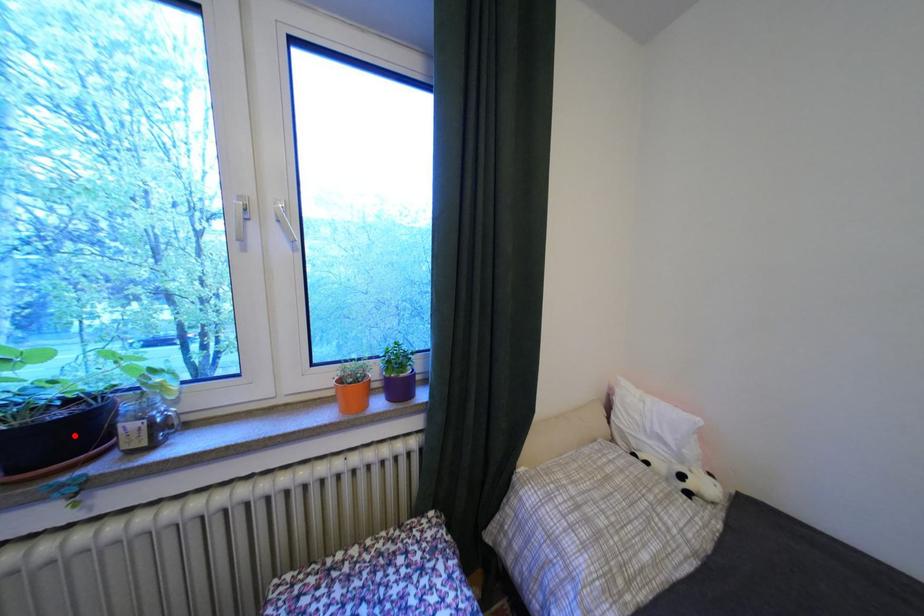
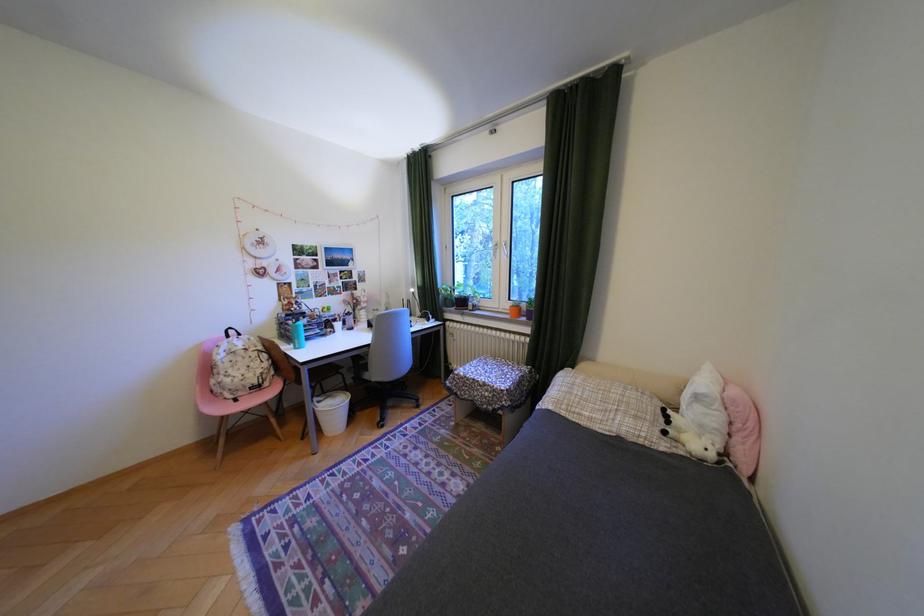
Locate, in the second image, the point that corresponds to the highlighted location in the first image.

(475, 302)